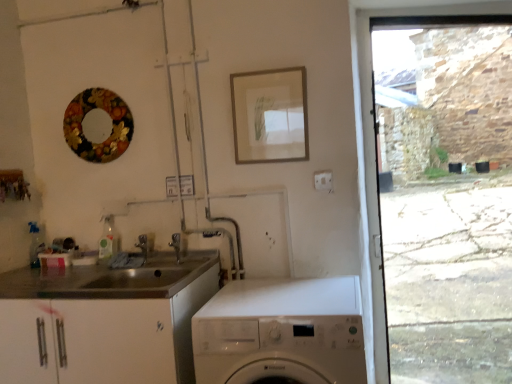
Question: From the image's perspective, is metallic floral wreath at upper left on top of wooden frame at upper center?

Choices:
 (A) no
 (B) yes

Answer: (A)

Question: Does metallic floral wreath at upper left have a lesser width compared to wooden frame at upper center?

Choices:
 (A) yes
 (B) no

Answer: (B)

Question: Is metallic floral wreath at upper left positioned with its back to wooden frame at upper center?

Choices:
 (A) yes
 (B) no

Answer: (B)

Question: Is wooden frame at upper center surrounded by metallic floral wreath at upper left?

Choices:
 (A) yes
 (B) no

Answer: (B)

Question: Considering the relative sizes of metallic floral wreath at upper left and wooden frame at upper center in the image provided, is metallic floral wreath at upper left taller than wooden frame at upper center?

Choices:
 (A) yes
 (B) no

Answer: (B)

Question: Choose the correct answer: Is wooden frame at upper center inside metallic floral wreath at upper left or outside it?

Choices:
 (A) inside
 (B) outside

Answer: (B)

Question: Relative to metallic floral wreath at upper left, is wooden frame at upper center in front or behind?

Choices:
 (A) front
 (B) behind

Answer: (A)

Question: From a real-world perspective, is wooden frame at upper center physically located above or below metallic floral wreath at upper left?

Choices:
 (A) above
 (B) below

Answer: (B)

Question: Considering the positions of wooden frame at upper center and metallic floral wreath at upper left in the image, is wooden frame at upper center taller or shorter than metallic floral wreath at upper left?

Choices:
 (A) short
 (B) tall

Answer: (B)

Question: Is metallic silver faucet at upper center, which is the first tap in right-to-left order, inside the boundaries of metallic floral wreath at upper left, or outside?

Choices:
 (A) inside
 (B) outside

Answer: (B)

Question: Would you say metallic silver faucet at upper center, the 2th tap in the back-to-front sequence, is to the left or to the right of metallic floral wreath at upper left in the picture?

Choices:
 (A) left
 (B) right

Answer: (B)

Question: From a real-world perspective, relative to metallic floral wreath at upper left, is metallic silver faucet at upper center, positioned as the first tap in front-to-back order, vertically above or below?

Choices:
 (A) above
 (B) below

Answer: (B)

Question: From the image's perspective, is metallic silver faucet at upper center, positioned as the first tap in front-to-back order, located above or below metallic floral wreath at upper left?

Choices:
 (A) below
 (B) above

Answer: (A)

Question: Considering the positions of white glossy washing machine at lower center and silver metallic tap at center, which appears as the first tap when viewed from the back, in the image, is white glossy washing machine at lower center taller or shorter than silver metallic tap at center, which appears as the first tap when viewed from the back,?

Choices:
 (A) short
 (B) tall

Answer: (B)

Question: From a real-world perspective, relative to silver metallic tap at center, which appears as the first tap when viewed from the left, is white glossy washing machine at lower center vertically above or below?

Choices:
 (A) above
 (B) below

Answer: (B)